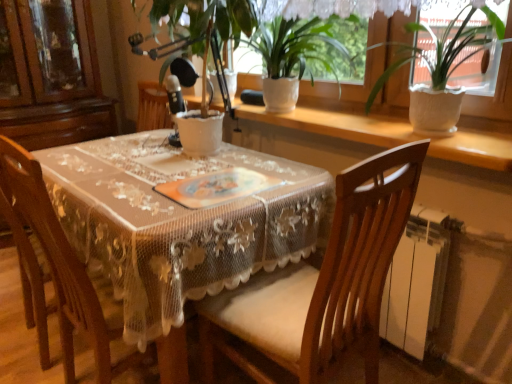
Measure the distance between point (321, 112) and camera.

6.32 feet.

Measure the distance between white ceramic pot at upper center, arranged as the 2th houseplant when viewed from the right, and camera.

They are 1.63 meters apart.

This screenshot has height=384, width=512. What do you see at coordinates (202, 33) in the screenshot? I see `white ceramic pot at center, which is the third houseplant in right-to-left order` at bounding box center [202, 33].

Locate an element on the screen. Image resolution: width=512 pixels, height=384 pixels. white ceramic pot at upper right, which ranks as the third houseplant in left-to-right order is located at coordinates (434, 69).

This screenshot has width=512, height=384. Describe the element at coordinates (178, 222) in the screenshot. I see `white lace tablecloth at center` at that location.

This screenshot has height=384, width=512. What do you see at coordinates (323, 283) in the screenshot? I see `wooden chair at center, the second chair viewed from the left` at bounding box center [323, 283].

In order to face wooden chair at center, which is the second chair from right to left, should I rotate leftwards or rightwards?

You should rotate left by 17.619 degrees.

Locate an element on the screen. The image size is (512, 384). white textured window sill at upper center is located at coordinates (337, 124).

Is white lace tablecloth at center at the back of wooden chair at center, which is the first chair in right-to-left order?

wooden chair at center, which is the first chair in right-to-left order, is not turned away from white lace tablecloth at center.

Considering the sizes of wooden chair at center, which is the first chair in right-to-left order, and white lace tablecloth at center in the image, is wooden chair at center, which is the first chair in right-to-left order, bigger or smaller than white lace tablecloth at center?

Clearly, wooden chair at center, which is the first chair in right-to-left order, is smaller in size than white lace tablecloth at center.

Considering the relative sizes of wooden chair at center, the second chair viewed from the left, and white lace tablecloth at center in the image provided, is wooden chair at center, the second chair viewed from the left, thinner than white lace tablecloth at center?

Yes.

Is wooden chair at center, which is the first chair in right-to-left order, positioned before white ceramic pot at upper right, which ranks as the third houseplant in left-to-right order?

Yes, the depth of wooden chair at center, which is the first chair in right-to-left order, is less than that of white ceramic pot at upper right, which ranks as the third houseplant in left-to-right order.

Does wooden chair at center, the second chair viewed from the left, have a lesser height compared to white ceramic pot at upper right, which is the 1th houseplant in right-to-left order?

No, wooden chair at center, the second chair viewed from the left, is not shorter than white ceramic pot at upper right, which is the 1th houseplant in right-to-left order.

Can white ceramic pot at upper right, which ranks as the third houseplant in left-to-right order, be found inside wooden chair at center, which is the first chair in right-to-left order?

That's incorrect, white ceramic pot at upper right, which ranks as the third houseplant in left-to-right order, is not inside wooden chair at center, which is the first chair in right-to-left order.

Is wooden chair at center, the second chair viewed from the left, oriented away from white ceramic pot at upper right, which is the 1th houseplant in right-to-left order?

No, wooden chair at center, the second chair viewed from the left, is not facing away from white ceramic pot at upper right, which is the 1th houseplant in right-to-left order.

Considering the sizes of objects wooden chair at center, the 1th chair from the left, and white ceramic pot at upper right, which is the 1th houseplant in right-to-left order, in the image provided, who is thinner, wooden chair at center, the 1th chair from the left, or white ceramic pot at upper right, which is the 1th houseplant in right-to-left order,?

white ceramic pot at upper right, which is the 1th houseplant in right-to-left order, is thinner.

Which of these two, wooden chair at center, which is the second chair from right to left, or white ceramic pot at upper right, which ranks as the third houseplant in left-to-right order, is smaller?

white ceramic pot at upper right, which ranks as the third houseplant in left-to-right order, is smaller.

Would you say wooden chair at center, the 1th chair from the left, is outside white ceramic pot at upper right, which is the 1th houseplant in right-to-left order?

Indeed, wooden chair at center, the 1th chair from the left, is completely outside white ceramic pot at upper right, which is the 1th houseplant in right-to-left order.

From the image's perspective, which one is positioned higher, white lace tablecloth at center or white textured window sill at upper center?

A: white textured window sill at upper center.

Choose the correct answer: Is white lace tablecloth at center inside white textured window sill at upper center or outside it?

white lace tablecloth at center exists outside the volume of white textured window sill at upper center.

What's the angular difference between white lace tablecloth at center and white textured window sill at upper center's facing directions?

The angle between the facing direction of white lace tablecloth at center and the facing direction of white textured window sill at upper center is 0.305 degrees.

Considering the relative sizes of white lace tablecloth at center and white textured window sill at upper center in the image provided, is white lace tablecloth at center shorter than white textured window sill at upper center?

In fact, white lace tablecloth at center may be taller than white textured window sill at upper center.

Does point (266, 81) lie in front of point (313, 275)?

No.

From a real-world perspective, which object stands above the other?

From a 3D spatial view, white ceramic pot at upper center, placed as the 2th houseplant when sorted from left to right, is above.

From the image's perspective, which is above, white ceramic pot at upper center, placed as the 2th houseplant when sorted from left to right, or wooden chair at center, the second chair viewed from the left?

white ceramic pot at upper center, placed as the 2th houseplant when sorted from left to right, is shown above in the image.

Which object is closer to the camera taking this photo, white textured window sill at upper center or wooden chair at center, the 1th chair from the left?

wooden chair at center, the 1th chair from the left, is more forward.

Is white textured window sill at upper center smaller than wooden chair at center, which is the second chair from right to left?

Yes, white textured window sill at upper center is smaller than wooden chair at center, which is the second chair from right to left.

From the image's perspective, which is above, white textured window sill at upper center or wooden chair at center, which is the second chair from right to left?

From the image's view, white textured window sill at upper center is above.

Does point (483, 157) come farther from viewer compared to point (74, 279)?

Yes, point (483, 157) is farther from viewer.

Considering the relative sizes of white textured window sill at upper center and wooden chair at center, which is the first chair in right-to-left order, in the image provided, is white textured window sill at upper center taller than wooden chair at center, which is the first chair in right-to-left order,?

In fact, white textured window sill at upper center may be shorter than wooden chair at center, which is the first chair in right-to-left order.

Is white textured window sill at upper center spatially inside wooden chair at center, which is the first chair in right-to-left order, or outside of it?

white textured window sill at upper center lies outside wooden chair at center, which is the first chair in right-to-left order.

How many degrees apart are the facing directions of white textured window sill at upper center and wooden chair at center, the second chair viewed from the left?

85.3 degrees.

In the scene shown: Does white textured window sill at upper center have a greater width compared to wooden chair at center, which is the first chair in right-to-left order?

No, white textured window sill at upper center is not wider than wooden chair at center, which is the first chair in right-to-left order.

In order to click on the 2nd chair below when counting from the white lace tablecloth at center (from the image's perspective) in this screenshot , I will do `click(323, 283)`.

This screenshot has width=512, height=384. Find the location of `houseplant that is the 2nd one when counting rightward from the wooden chair at center, the second chair viewed from the left`. houseplant that is the 2nd one when counting rightward from the wooden chair at center, the second chair viewed from the left is located at coordinates (434, 69).

When comparing their distances from white lace tablecloth at center, does white textured window sill at upper center or white ceramic pot at upper right, which ranks as the third houseplant in left-to-right order, seem closer?

Based on the image, white textured window sill at upper center appears to be nearer to white lace tablecloth at center.

Which object lies further to the anchor point white textured window sill at upper center, wooden chair at center, which is the first chair in right-to-left order, or white lace tablecloth at center?

wooden chair at center, which is the first chair in right-to-left order, is positioned further to the anchor white textured window sill at upper center.

In the scene shown: Looking at the image, which one is located closer to white textured window sill at upper center, white lace tablecloth at center or white ceramic pot at center, the first houseplant from the left?

Based on the image, white ceramic pot at center, the first houseplant from the left, appears to be nearer to white textured window sill at upper center.

Looking at the image, which one is located further to wooden chair at center, which is the first chair in right-to-left order, wooden chair at center, which is the second chair from right to left, or white ceramic pot at upper right, which is the 1th houseplant in right-to-left order?

The object further to wooden chair at center, which is the first chair in right-to-left order, is white ceramic pot at upper right, which is the 1th houseplant in right-to-left order.

Based on their spatial positions, is white textured window sill at upper center or wooden chair at center, the second chair viewed from the left, closer to white ceramic pot at upper right, which ranks as the third houseplant in left-to-right order?

white textured window sill at upper center.

Which object lies nearer to the anchor point wooden chair at center, the 1th chair from the left, white ceramic pot at upper right, which ranks as the third houseplant in left-to-right order, or white ceramic pot at upper center, placed as the 2th houseplant when sorted from left to right?

Based on the image, white ceramic pot at upper center, placed as the 2th houseplant when sorted from left to right, appears to be nearer to wooden chair at center, the 1th chair from the left.

When comparing their distances from white ceramic pot at upper right, which is the 1th houseplant in right-to-left order, does wooden chair at center, which is the first chair in right-to-left order, or white textured window sill at upper center seem closer?

white textured window sill at upper center lies closer to white ceramic pot at upper right, which is the 1th houseplant in right-to-left order, than the other object.

Which object lies nearer to the anchor point white lace tablecloth at center, wooden chair at center, which is the second chair from right to left, or wooden chair at center, which is the first chair in right-to-left order?

wooden chair at center, which is the second chair from right to left, is positioned closer to the anchor white lace tablecloth at center.

Where is `chair between wooden chair at center, the 1th chair from the left, and white ceramic pot at upper right, which is the 1th houseplant in right-to-left order, in the horizontal direction`? The height and width of the screenshot is (384, 512). chair between wooden chair at center, the 1th chair from the left, and white ceramic pot at upper right, which is the 1th houseplant in right-to-left order, in the horizontal direction is located at coordinates (323, 283).

Identify the location of table between white ceramic pot at center, which is the third houseplant in right-to-left order, and wooden chair at center, which is the second chair from right to left, in the vertical direction. The width and height of the screenshot is (512, 384). (178, 222).

This screenshot has height=384, width=512. Find the location of `window sill between white ceramic pot at upper center, placed as the 2th houseplant when sorted from left to right, and white ceramic pot at upper right, which is the 1th houseplant in right-to-left order`. window sill between white ceramic pot at upper center, placed as the 2th houseplant when sorted from left to right, and white ceramic pot at upper right, which is the 1th houseplant in right-to-left order is located at coordinates (337, 124).

At what (x,y) coordinates should I click in order to perform the action: click on window sill between white ceramic pot at center, which is the third houseplant in right-to-left order, and white ceramic pot at upper right, which ranks as the third houseplant in left-to-right order, in the horizontal direction. Please return your answer as a coordinate pair (x, y). Looking at the image, I should click on (337, 124).